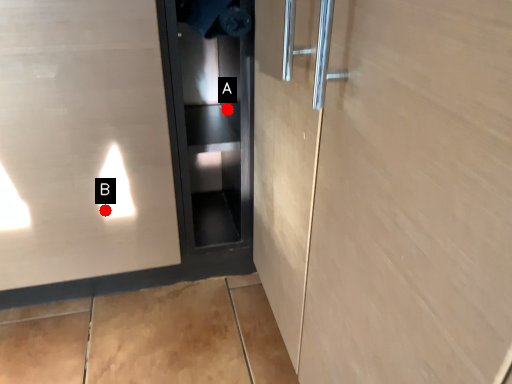
Question: Two points are circled on the image, labeled by A and B beside each circle. Which of the following is the farthest from the observer?

Choices:
 (A) A is further
 (B) B is further

Answer: (A)